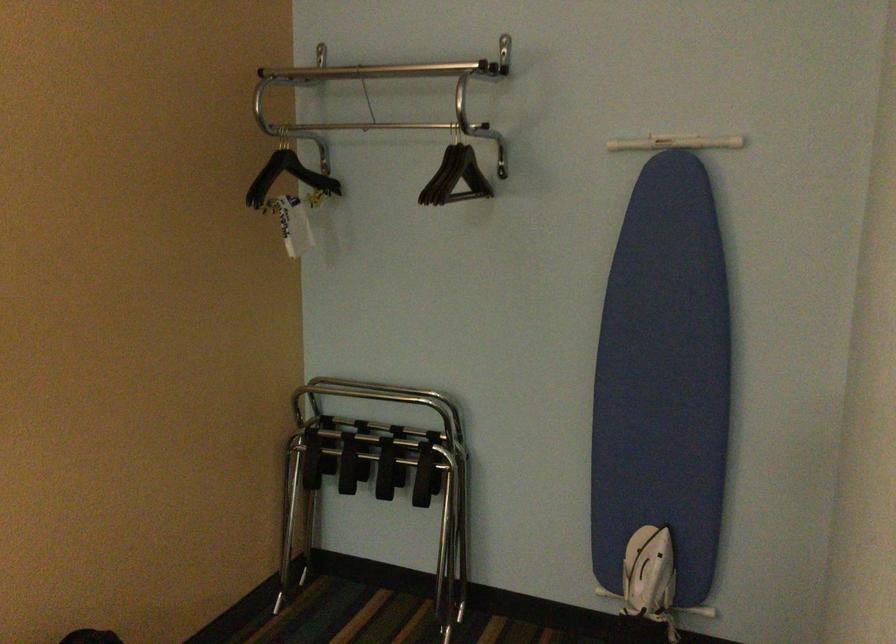
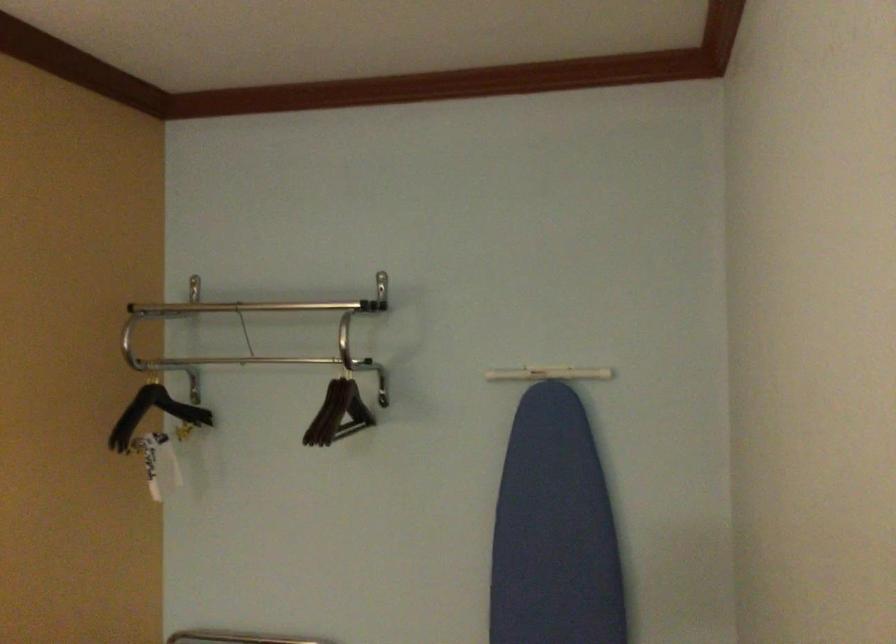
Which direction would the cameraman need to move to produce the second image?

The cameraman moved toward left, forward.